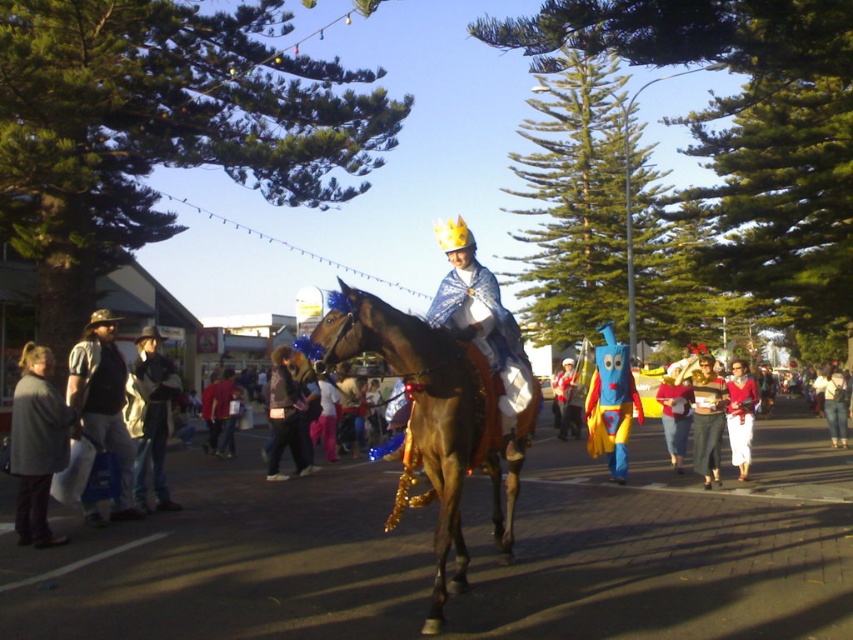
Is brown shiny horse at center shorter than brushed metal vest at left?

No.

Between brown shiny horse at center and brushed metal vest at left, which one is positioned lower?

brown shiny horse at center is below.

Is point (511, 492) closer to camera compared to point (80, 349)?

Yes, it is.

Image resolution: width=853 pixels, height=640 pixels. In order to click on brown shiny horse at center in this screenshot , I will do click(432, 419).